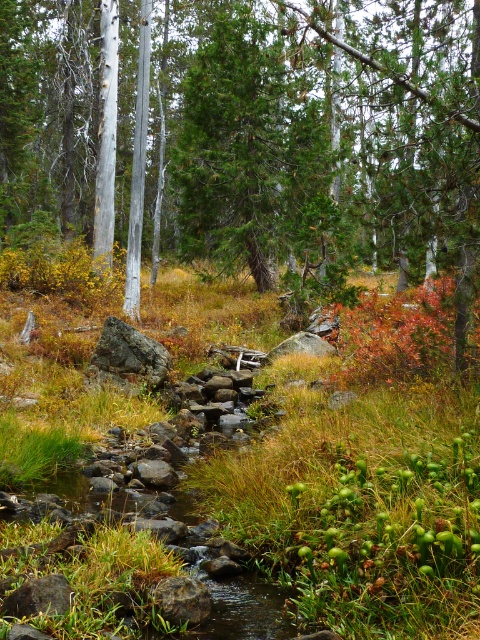
You are a hiker trying to determine the best spot to set up a tent. You notice a green textured tree at center and a gray rock at center in the scene. Which object would provide more shade if you place your tent near it?

The green textured tree at center is much taller than the gray rock at center, so it would provide more shade for your tent.